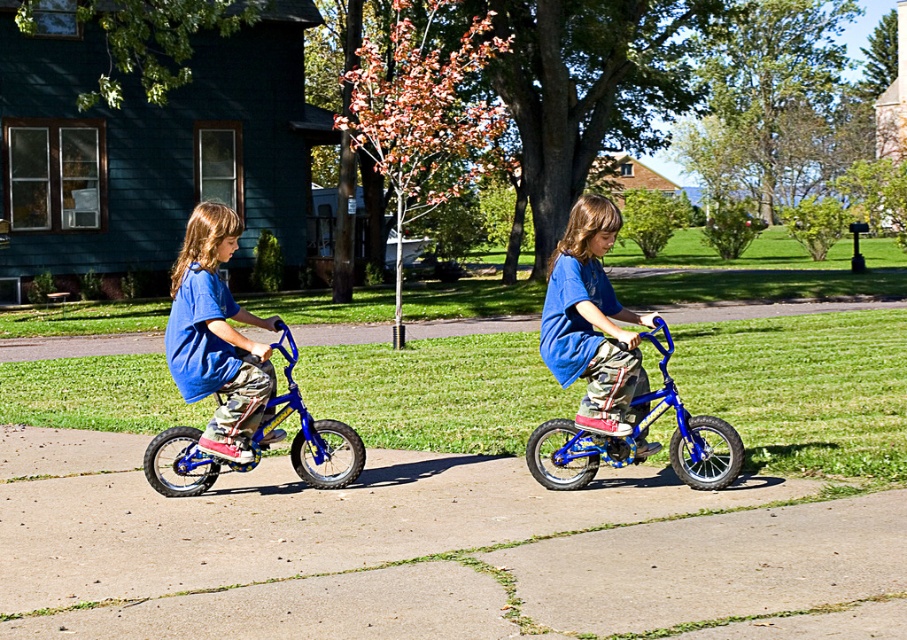
Which is in front, point (606, 236) or point (177, 484)?

Point (606, 236) is more forward.

In the scene shown: Is matte blue shirt at center to the left of shiny blue bicycle at left from the viewer's perspective?

No, matte blue shirt at center is not to the left of shiny blue bicycle at left.

Is point (583, 298) in front of point (218, 404)?

That is True.

Where is `matte blue shirt at center`? matte blue shirt at center is located at coordinates (591, 321).

Can you confirm if matte blue shirt at left is bigger than blue metallic bicycle at center?

No, matte blue shirt at left is not bigger than blue metallic bicycle at center.

Image resolution: width=907 pixels, height=640 pixels. What do you see at coordinates (215, 336) in the screenshot?
I see `matte blue shirt at left` at bounding box center [215, 336].

Is point (235, 360) more distant than point (699, 429)?

Yes, it is.

Image resolution: width=907 pixels, height=640 pixels. I want to click on matte blue shirt at left, so click(215, 336).

Which is more to the right, matte blue shirt at center or blue metallic bicycle at center?

Positioned to the right is blue metallic bicycle at center.

Between matte blue shirt at center and blue metallic bicycle at center, which one is positioned lower?

blue metallic bicycle at center is lower down.

Does point (608, 417) lie behind point (630, 436)?

Yes, point (608, 417) is behind point (630, 436).

Find the location of a particular element. The image size is (907, 640). matte blue shirt at center is located at coordinates (591, 321).